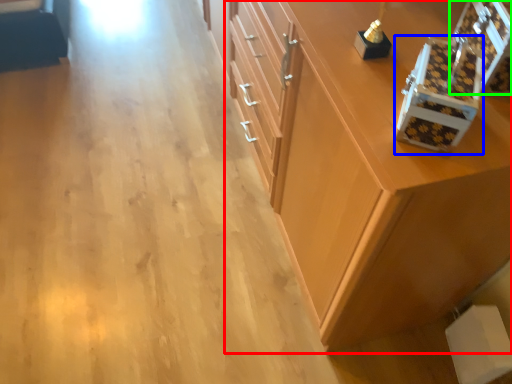
Question: Estimate the real-world distances between objects in this image. Which object is closer to cabinetry (highlighted by a red box), box (highlighted by a blue box) or box (highlighted by a green box)?

Choices:
 (A) box
 (B) box

Answer: (A)